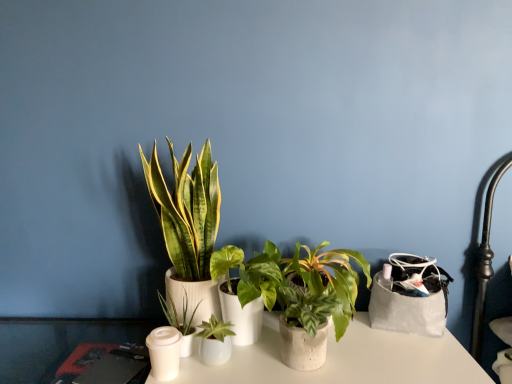
Question: In terms of width, does white matte candle holder at lower left look wider or thinner when compared to green matte plant at center, the 4th houseplant from the left?

Choices:
 (A) thin
 (B) wide

Answer: (A)

Question: Which is correct: white matte candle holder at lower left is inside green matte plant at center, the 4th houseplant from the left, or outside of it?

Choices:
 (A) outside
 (B) inside

Answer: (A)

Question: Considering the real-world distances, which object is farthest from the green matte plant at center, acting as the second houseplant starting from the right?

Choices:
 (A) green matte plant at center, the 2th houseplant positioned from the left
 (B) green leafy plant at center, the first houseplant viewed from the left
 (C) white matte candle holder at lower left
 (D) green matte plant at center, marked as the 3th houseplant in a right-to-left arrangement
 (E) speckled concrete pot at center, arranged as the 1th houseplant when viewed from the right

Answer: (C)

Question: Which object is the closest to the speckled concrete pot at center, arranged as the 1th houseplant when viewed from the right?

Choices:
 (A) green matte plant at center, which ranks as the 4th houseplant in right-to-left order
 (B) green matte plant at center, the 4th houseplant from the left
 (C) white matte candle holder at lower left
 (D) green leafy plant at center, the first houseplant viewed from the left
 (E) green matte plant at center, which is counted as the 3th houseplant, starting from the left

Answer: (B)